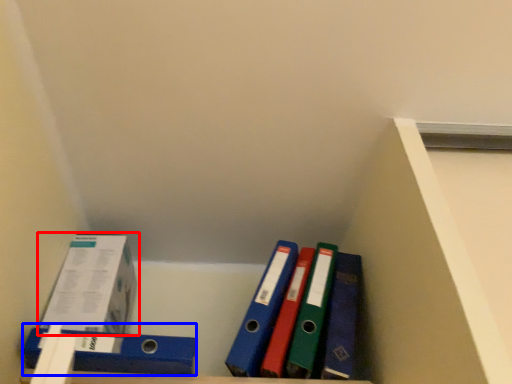
Question: Which object is closer to the camera taking this photo, box (highlighted by a red box) or binder (highlighted by a blue box)?

Choices:
 (A) box
 (B) binder

Answer: (B)